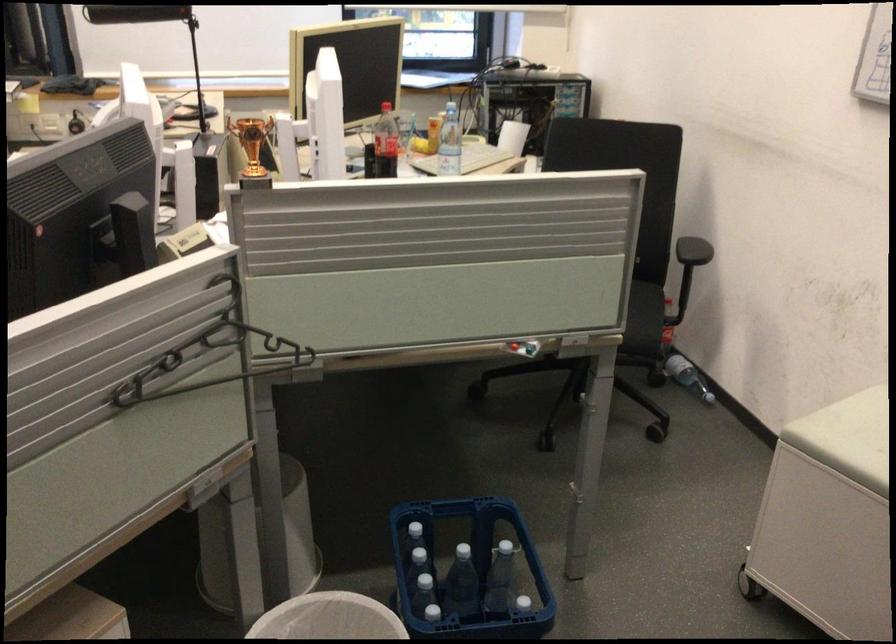
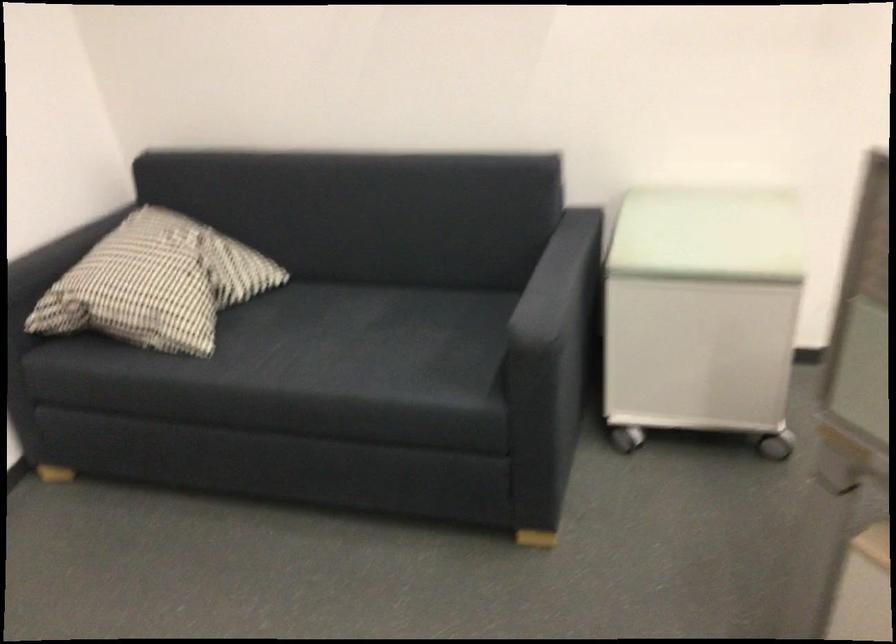
The first image is from the beginning of the video and the second image is from the end. How did the camera likely rotate when shooting the video?

The rotation direction of the camera is left-down.